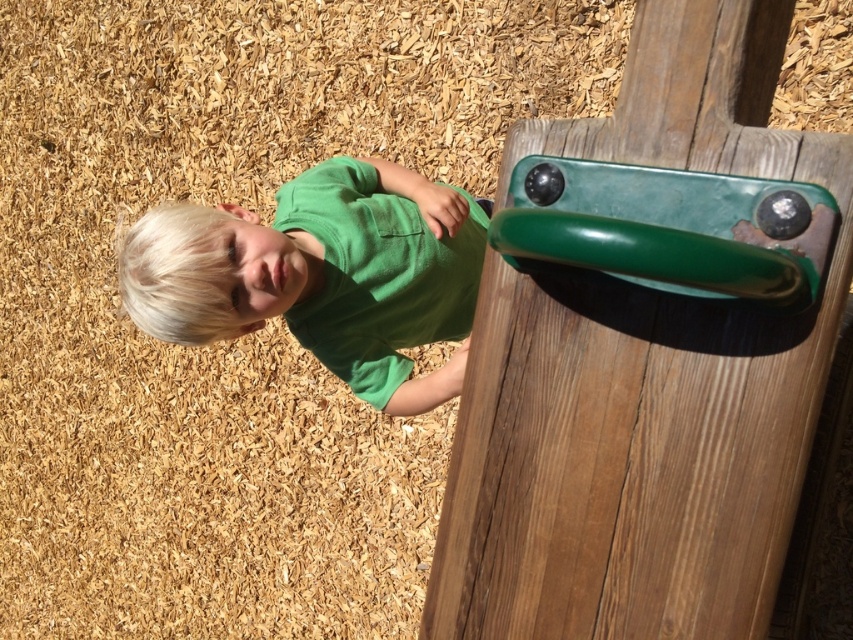
Question: Can you confirm if green glossy handle at upper right is positioned below green matte shirt at center?

Choices:
 (A) yes
 (B) no

Answer: (A)

Question: Can you confirm if green glossy handle at upper right is positioned below green matte shirt at center?

Choices:
 (A) no
 (B) yes

Answer: (B)

Question: Can you confirm if green glossy handle at upper right is positioned to the left of green matte shirt at center?

Choices:
 (A) no
 (B) yes

Answer: (A)

Question: Which point is closer to the camera?

Choices:
 (A) (750, 68)
 (B) (154, 269)

Answer: (A)